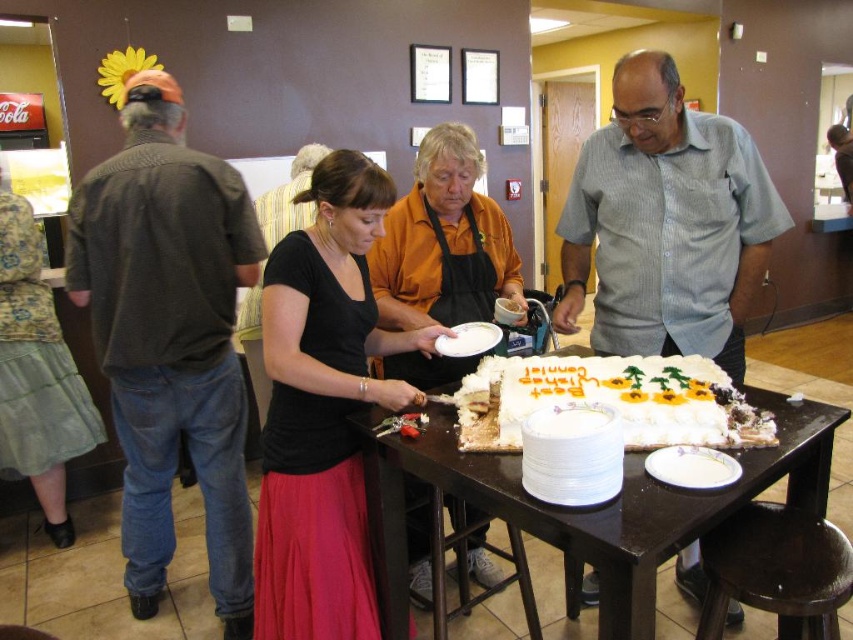
Who is higher up, black matte shirt at center or white frosted cake at center?

Positioned higher is black matte shirt at center.

From the picture: Can you confirm if black matte shirt at center is positioned to the left of white frosted cake at center?

Indeed, black matte shirt at center is positioned on the left side of white frosted cake at center.

Locate an element on the screen. The height and width of the screenshot is (640, 853). black matte shirt at center is located at coordinates (444, 241).

Who is positioned more to the right, white glossy cake at center or black matte shirt at center?

→ Positioned to the right is white glossy cake at center.

Does white glossy cake at center have a lesser width compared to black matte shirt at center?

Incorrect, white glossy cake at center's width is not less than black matte shirt at center's.

Identify the location of white glossy cake at center. (589, 508).

The width and height of the screenshot is (853, 640). In order to click on white glossy cake at center in this screenshot , I will do `click(589, 508)`.

Is point (607, 140) farther from camera compared to point (659, 387)?

Yes, it is behind point (659, 387).

Which is above, gray striped shirt at center or white frosted cake at center?

gray striped shirt at center

Between point (674, 218) and point (717, 440), which one is positioned in front?

Positioned in front is point (717, 440).

You are a GUI agent. You are given a task and a screenshot of the screen. Output one action in this format:
    pyautogui.click(x=<x>, y=<y>)
    Task: Click on the gray striped shirt at center
    The image size is (853, 640).
    Given the screenshot: What is the action you would take?
    pyautogui.click(x=666, y=224)